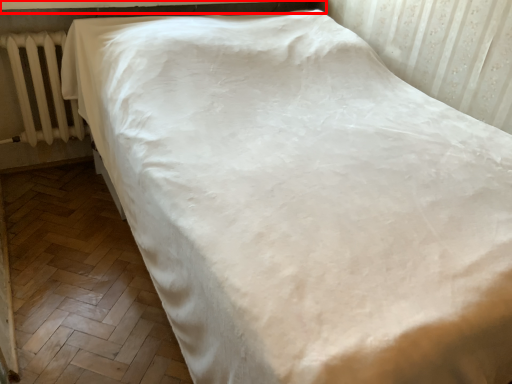
Question: Considering the relative positions of window sill (annotated by the red box) and radiator in the image provided, where is window sill (annotated by the red box) located with respect to the staircase?

Choices:
 (A) right
 (B) left

Answer: (A)